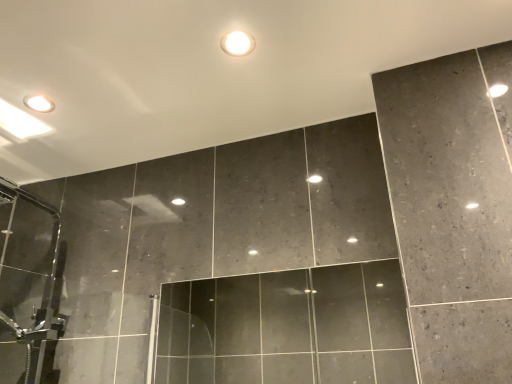
Question: Should I look upward or downward to see dark gray marble wall at upper center?

Choices:
 (A) up
 (B) down

Answer: (A)

Question: From a real-world perspective, is transparent glass door at center beneath dark gray marble wall at upper center?

Choices:
 (A) yes
 (B) no

Answer: (A)

Question: Considering the relative sizes of transparent glass door at center and dark gray marble wall at upper center in the image provided, is transparent glass door at center wider than dark gray marble wall at upper center?

Choices:
 (A) no
 (B) yes

Answer: (A)

Question: Is transparent glass door at center far away from dark gray marble wall at upper center?

Choices:
 (A) yes
 (B) no

Answer: (A)

Question: From the image's perspective, would you say transparent glass door at center is shown under dark gray marble wall at upper center?

Choices:
 (A) no
 (B) yes

Answer: (B)

Question: Is transparent glass door at center positioned with its back to dark gray marble wall at upper center?

Choices:
 (A) no
 (B) yes

Answer: (A)

Question: Could you tell me if transparent glass door at center is facing dark gray marble wall at upper center?

Choices:
 (A) yes
 (B) no

Answer: (B)

Question: Is dark gray marble wall at upper center closer to the viewer compared to matte white droplight at upper center?

Choices:
 (A) yes
 (B) no

Answer: (A)

Question: Are dark gray marble wall at upper center and matte white droplight at upper center located far from each other?

Choices:
 (A) yes
 (B) no

Answer: (B)

Question: Is dark gray marble wall at upper center completely or partially outside of matte white droplight at upper center?

Choices:
 (A) no
 (B) yes

Answer: (B)

Question: Considering the relative sizes of dark gray marble wall at upper center and matte white droplight at upper center in the image provided, is dark gray marble wall at upper center thinner than matte white droplight at upper center?

Choices:
 (A) yes
 (B) no

Answer: (B)

Question: Does dark gray marble wall at upper center have a larger size compared to matte white droplight at upper center?

Choices:
 (A) yes
 (B) no

Answer: (A)

Question: Is matte white droplight at upper center at the back of dark gray marble wall at upper center?

Choices:
 (A) no
 (B) yes

Answer: (B)

Question: Is matte white droplight at upper center turned away from dark gray marble wall at upper center?

Choices:
 (A) no
 (B) yes

Answer: (B)